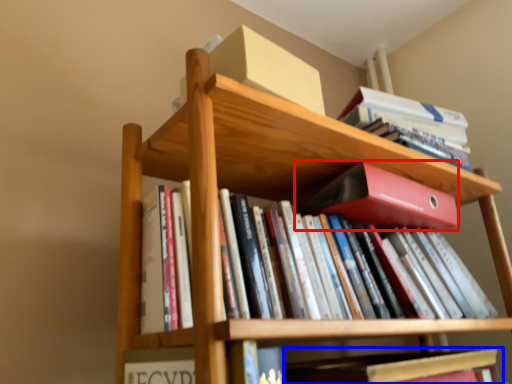
Question: Which of the following is the farthest to the observer, paperback book (highlighted by a red box) or book (highlighted by a blue box)?

Choices:
 (A) paperback book
 (B) book

Answer: (A)